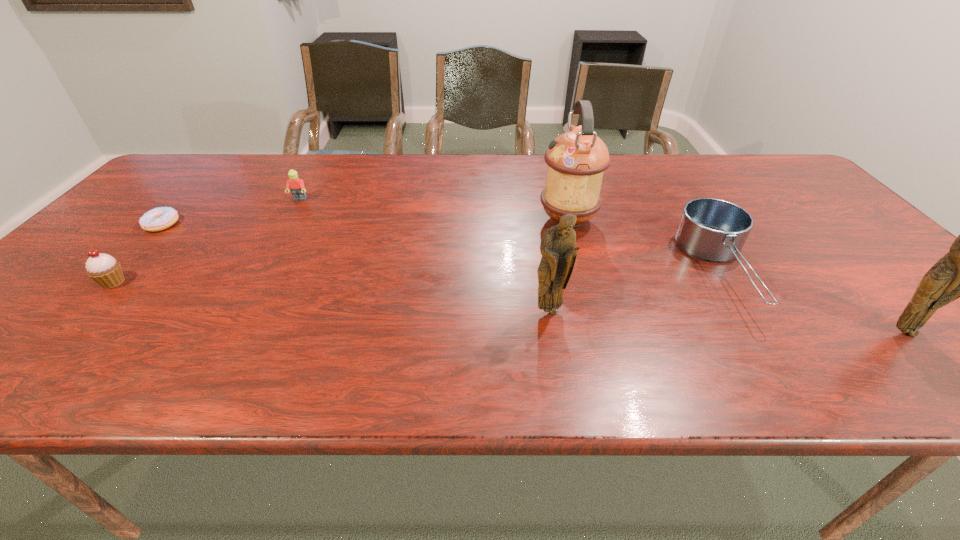
Locate an element on the screen. vacant point located on the face of the third object from left to right is located at coordinates pos(293,212).

Where is `blank area located 0.250m on the front of the oil lamp`? blank area located 0.250m on the front of the oil lamp is located at coordinates (590, 305).

This screenshot has height=540, width=960. Find the location of `vacant region located on the left of the cupcake`. vacant region located on the left of the cupcake is located at coordinates (78, 282).

The image size is (960, 540). In order to click on vacant space located 0.210m on the right of the doughnut in this screenshot , I will do `click(255, 224)`.

Identify the location of saucepan that is positioned at the near edge. This screenshot has height=540, width=960. (714, 230).

Find the location of a particular element. The image size is (960, 540). cupcake at the left edge is located at coordinates (106, 271).

Where is `doughnut that is at the left edge`? doughnut that is at the left edge is located at coordinates (160, 218).

Identify the location of object positioned at the right edge. (959, 274).

Find the location of a particular element. This screenshot has width=960, height=540. object located at the near right corner is located at coordinates (959, 274).

Identify the location of vacant region at the far edge. This screenshot has height=540, width=960. (369, 181).